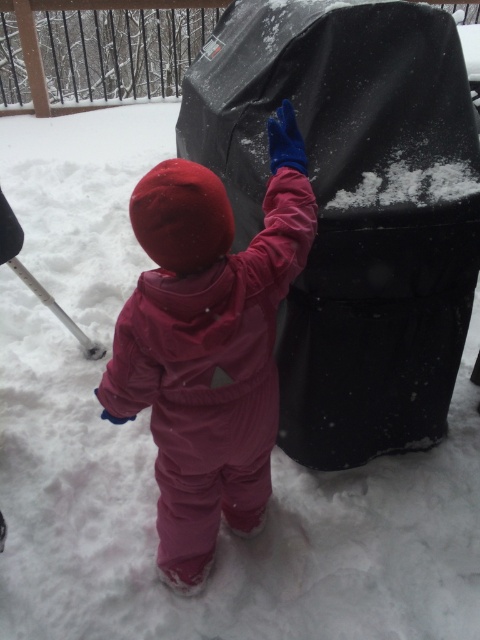
The child in the red hooded jacket and blue gloves is near the black matte grill at center and the matte pink snowsuit at center. Which object is taller?

The black matte grill at center is taller than the matte pink snowsuit at center.

You are a parent watching your child play in the snow. You see the black matte grill at center and the matte pink snowsuit at center. Which object is positioned more to the right side of the scene?

The black matte grill at center is positioned to the right of the matte pink snowsuit at center, so the black matte grill at center is more to the right side of the scene.

Looking at this image, what are the coordinates of the black matte grill at center?

The black matte grill at center is located at coordinates (352, 209).